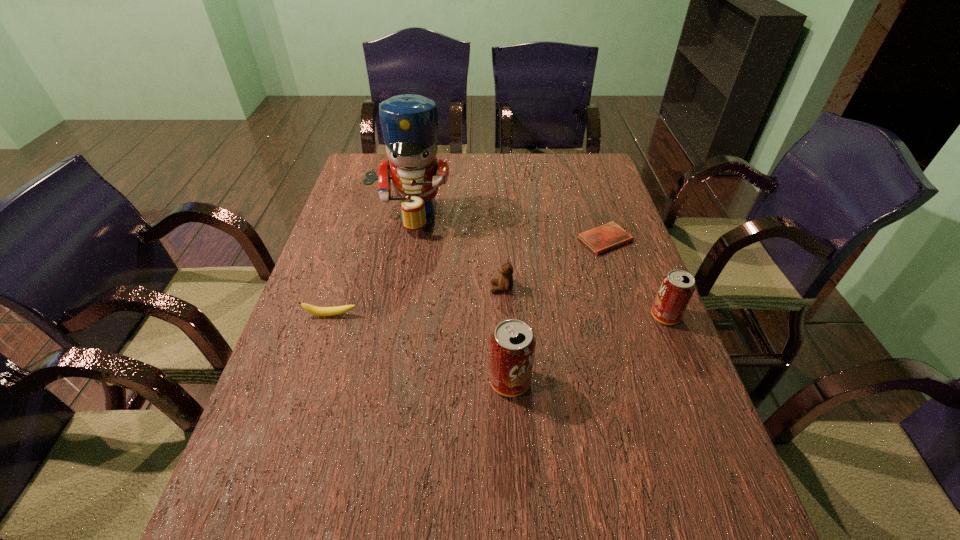
Find the location of a particular element. Image resolution: width=960 pixels, height=540 pixels. vacant space located 0.080m on the back of the farther soda can is located at coordinates 652,283.

Locate an element on the screen. vacant space located 0.380m on the front-facing side of the nutcracker is located at coordinates 387,341.

Locate an element on the screen. The height and width of the screenshot is (540, 960). free space located 0.340m on the front of the shortest object is located at coordinates (641, 354).

You are a GUI agent. You are given a task and a screenshot of the screen. Output one action in this format:
    pyautogui.click(x=<x>, y=<y>)
    Task: Click on the vacant point located 0.180m at the face of the third farthest object
    The width and height of the screenshot is (960, 540).
    Given the screenshot: What is the action you would take?
    pyautogui.click(x=422, y=288)

Identify the location of vacant area situated at the face of the third farthest object. (372, 288).

Find the location of a particular element. The height and width of the screenshot is (540, 960). free space located at the face of the third farthest object is located at coordinates (419, 288).

At what (x,y) coordinates should I click in order to perform the action: click on free space located on the upward curve of the second shortest object. Please return your answer as a coordinate pair (x, y). The width and height of the screenshot is (960, 540). Looking at the image, I should click on (307, 389).

At what (x,y) coordinates should I click in order to perform the action: click on nutcracker located at the left edge. Please return your answer as a coordinate pair (x, y). Looking at the image, I should click on (409, 122).

I want to click on banana at the left edge, so click(x=319, y=311).

Find the location of `soda can that is positioned at the right edge`. soda can that is positioned at the right edge is located at coordinates (677, 287).